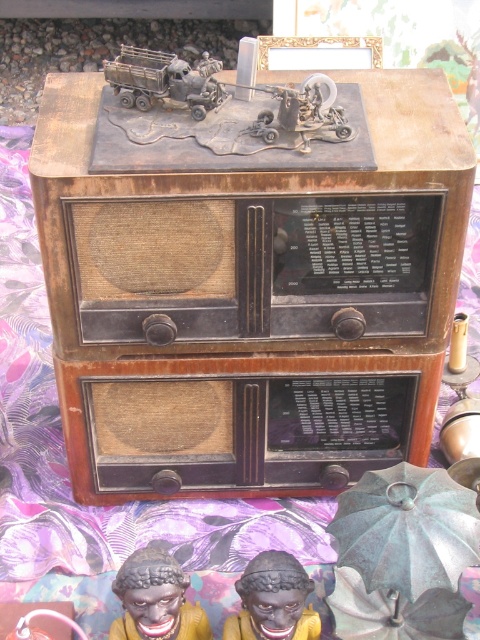
The height and width of the screenshot is (640, 480). What do you see at coordinates (156, 600) in the screenshot?
I see `black matte clown mask at lower center` at bounding box center [156, 600].

Does point (165, 557) come farther from viewer compared to point (20, 618)?

No, it is in front of (20, 618).

You are a GUI agent. You are given a task and a screenshot of the screen. Output one action in this format:
    pyautogui.click(x=<x>, y=<y>)
    Task: Click on the black matte clown mask at lower center
    Image resolution: width=480 pixels, height=640 pixels.
    Given the screenshot: What is the action you would take?
    pyautogui.click(x=156, y=600)

Is green patina metal umbrella at lower right behind black matte figurine at lower center?

That is False.

Locate an element on the screen. This screenshot has width=480, height=640. green patina metal umbrella at lower right is located at coordinates (407, 529).

Does green matte umbrella at center have a greater height compared to metallic gray truck at upper center?

Indeed, green matte umbrella at center has a greater height compared to metallic gray truck at upper center.

Does green matte umbrella at center have a lesser height compared to metallic gray truck at upper center?

Incorrect, green matte umbrella at center's height does not fall short of metallic gray truck at upper center's.

Is point (372, 595) farther from viewer compared to point (192, 68)?

Yes, it is behind point (192, 68).

Where is `green matte umbrella at center`? green matte umbrella at center is located at coordinates coord(394,611).